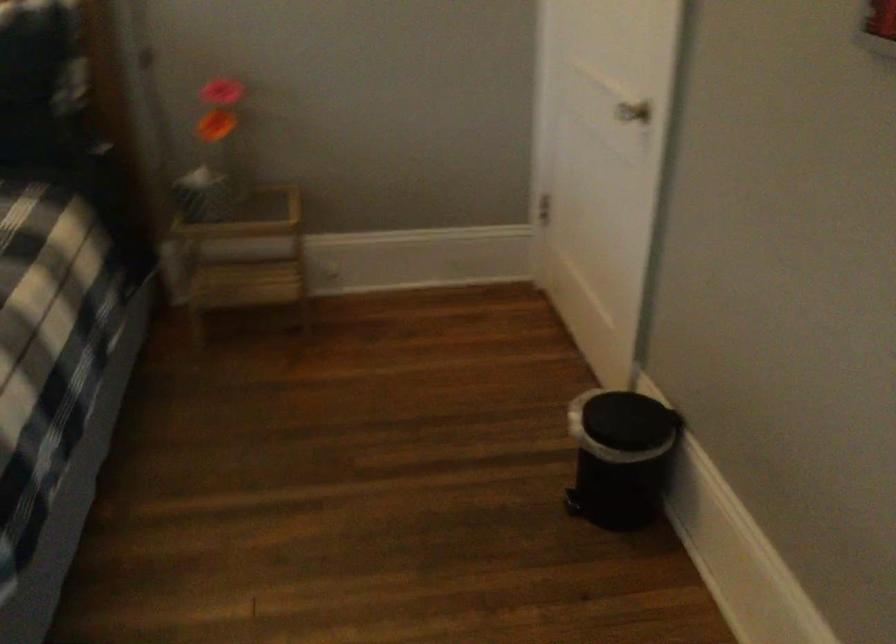
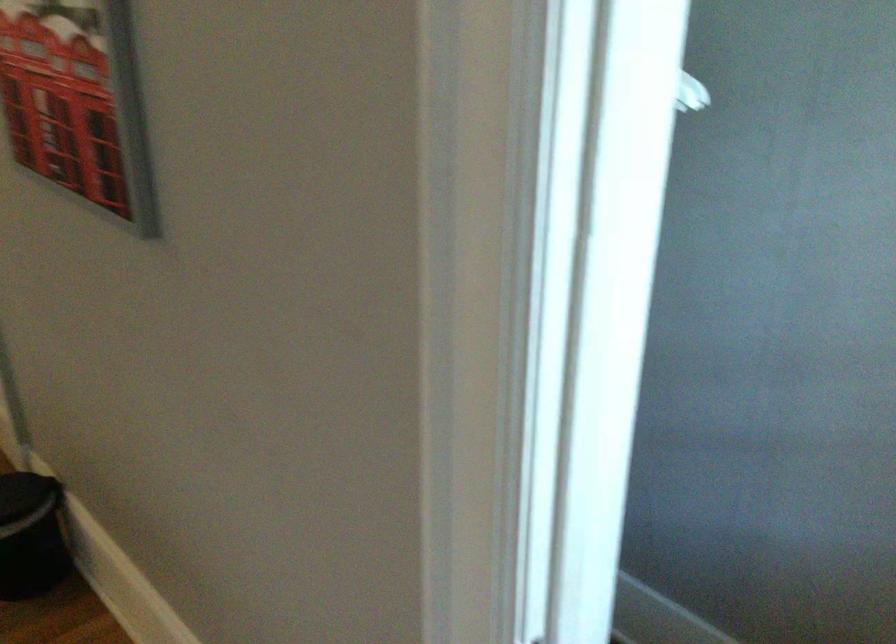
Question: The camera is either moving clockwise (left) or counter-clockwise (right) around the object. The first image is from the beginning of the video and the second image is from the end. Is the camera moving left or right when shooting the video?

Choices:
 (A) Left
 (B) Right

Answer: (A)